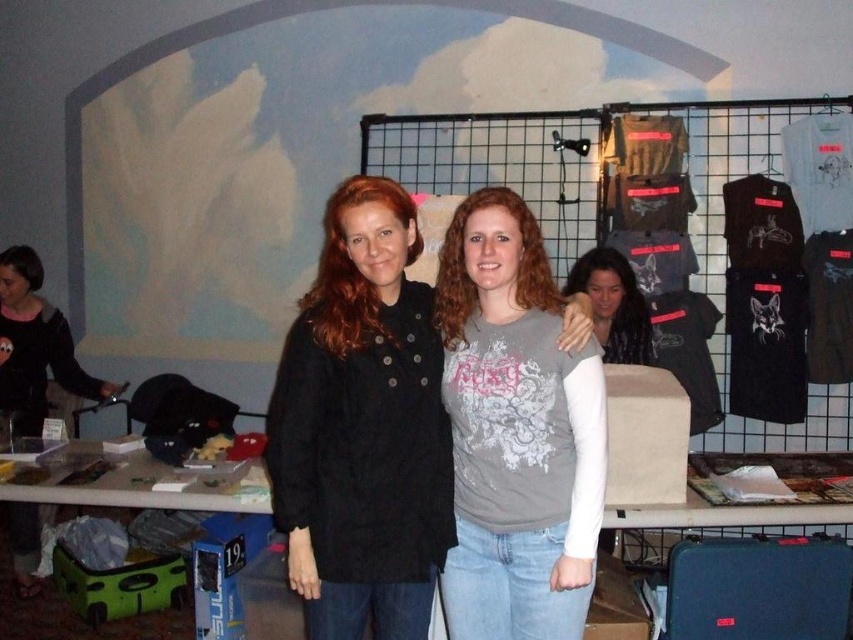
Find the location of `gray matte shirt at center`. gray matte shirt at center is located at coordinates (515, 432).

Does gray matte shirt at center have a greater height compared to black matte jacket at left?

Indeed, gray matte shirt at center has a greater height compared to black matte jacket at left.

Find the location of a particular element. gray matte shirt at center is located at coordinates click(x=515, y=432).

This screenshot has height=640, width=853. What do you see at coordinates (363, 426) in the screenshot?
I see `matte black jacket at center` at bounding box center [363, 426].

In the scene shown: Does matte black jacket at center appear under gray matte shirt at center?

Incorrect, matte black jacket at center is not positioned below gray matte shirt at center.

Identify the location of matte black jacket at center. Image resolution: width=853 pixels, height=640 pixels. (363, 426).

The height and width of the screenshot is (640, 853). I want to click on matte black jacket at center, so click(363, 426).

Between point (426, 564) and point (572, 292), which one is positioned behind?

Point (572, 292)

Is point (337, 404) behind point (585, 262)?

No.

Locate an element on the screen. This screenshot has height=640, width=853. matte black jacket at center is located at coordinates (x=363, y=426).

The height and width of the screenshot is (640, 853). I want to click on matte black jacket at center, so click(363, 426).